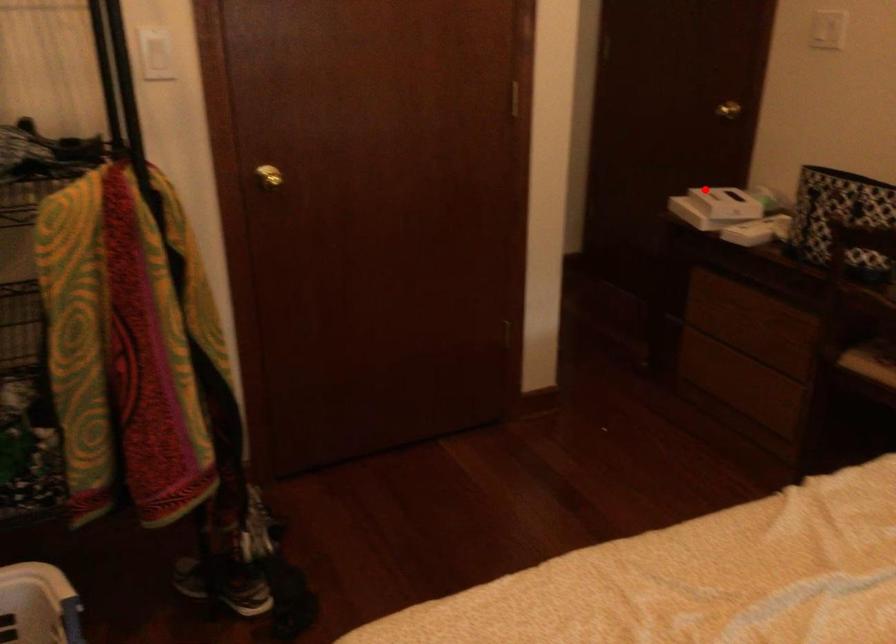
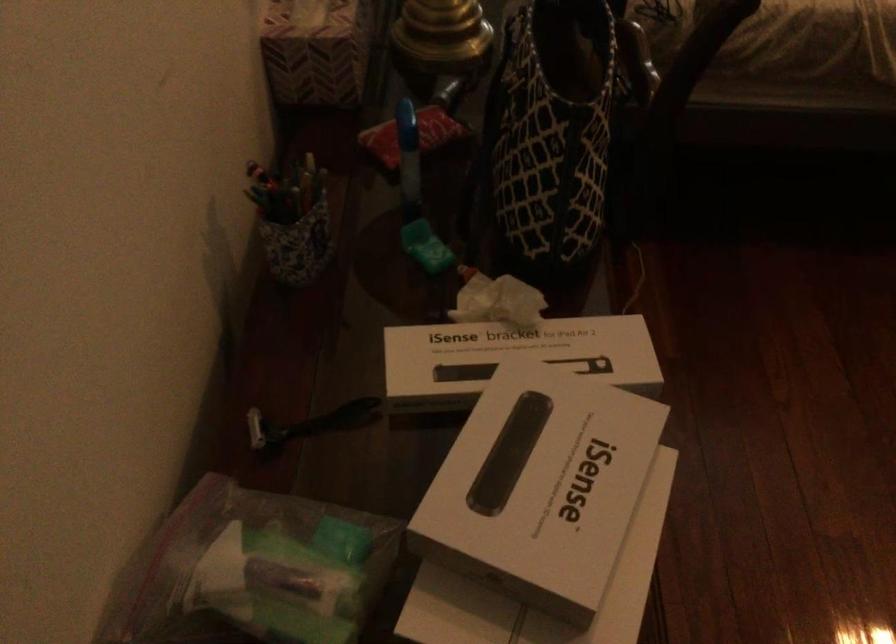
Question: I am providing you with two images of the same scene from different viewpoints. In image1, a red point is highlighted. Considering the same 3D point in image2, which of the following is correct?

Choices:
 (A) It is closer
 (B) It is farther

Answer: (A)